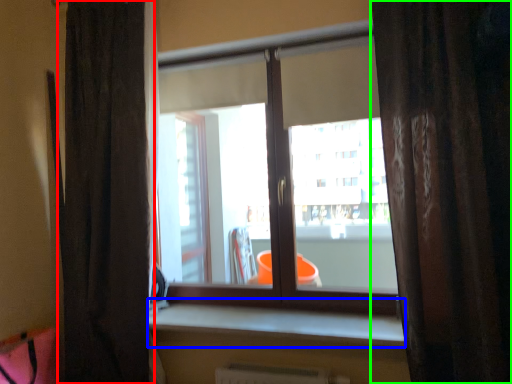
Question: Which object is the closest to the curtain (highlighted by a red box)? Choose among these: window sill (highlighted by a blue box) or curtain (highlighted by a green box).

Choices:
 (A) window sill
 (B) curtain

Answer: (A)